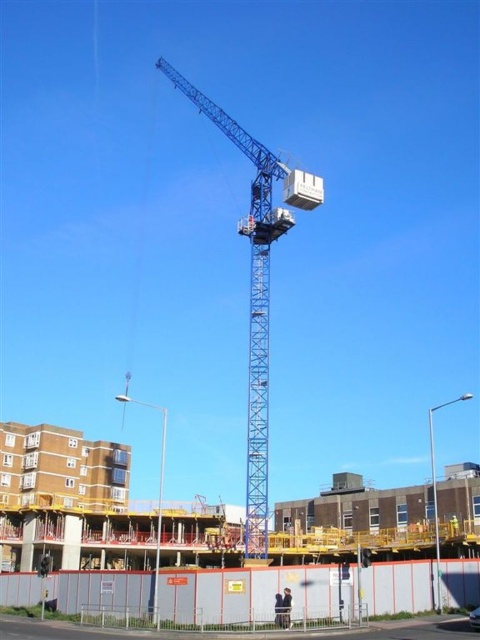
Question: Is the position of blue metallic crane at center more distant than that of white plastic lift at upper center?

Choices:
 (A) yes
 (B) no

Answer: (B)

Question: Is blue metallic crane at center thinner than white plastic lift at upper center?

Choices:
 (A) yes
 (B) no

Answer: (B)

Question: Which of the following is the closest to the observer?

Choices:
 (A) blue metallic crane at center
 (B) white plastic lift at upper center

Answer: (A)

Question: Which point is closer to the camera?

Choices:
 (A) (312, 177)
 (B) (264, 349)

Answer: (B)

Question: From the image, what is the correct spatial relationship of blue metallic crane at center in relation to white plastic lift at upper center?

Choices:
 (A) below
 (B) above

Answer: (A)